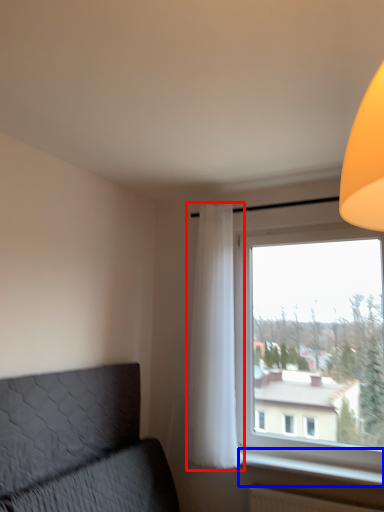
Question: Among these objects, which one is farthest to the camera, curtain (highlighted by a red box) or window sill (highlighted by a blue box)?

Choices:
 (A) curtain
 (B) window sill

Answer: (A)